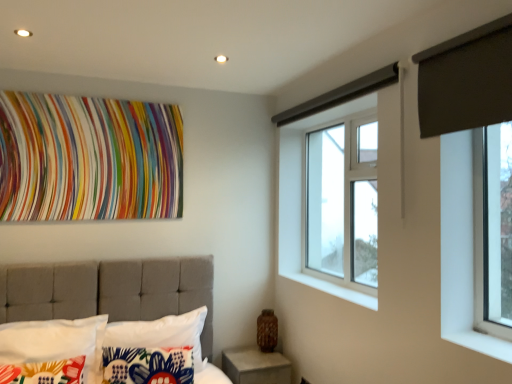
What do you see at coordinates (51, 351) in the screenshot? The width and height of the screenshot is (512, 384). I see `white fabric pillow at lower left, arranged as the 1th pillow when viewed from the left` at bounding box center [51, 351].

What is the approximate width of white fabric pillow at lower left, arranged as the 1th pillow when viewed from the left?

The width of white fabric pillow at lower left, arranged as the 1th pillow when viewed from the left, is 8.22 inches.

Measure the distance between dark gray fabric at upper right and camera.

The distance of dark gray fabric at upper right from camera is 5.12 feet.

The width and height of the screenshot is (512, 384). What do you see at coordinates (148, 365) in the screenshot?
I see `floral fabric pillow at lower left, the 2th pillow in the right-to-left sequence` at bounding box center [148, 365].

Locate an element on the screen. floral fabric pillow at lower left, the 2th pillow in the right-to-left sequence is located at coordinates (148, 365).

Locate an element on the screen. This screenshot has width=512, height=384. white fabric pillow at lower left, arranged as the 1th pillow when viewed from the left is located at coordinates (51, 351).

Is multicolored fabric at upper center in front of or behind concrete at lower right in the image?

multicolored fabric at upper center is in front of concrete at lower right.

Considering the relative positions of multicolored fabric at upper center and concrete at lower right in the image provided, is multicolored fabric at upper center to the right of concrete at lower right from the viewer's perspective?

No, multicolored fabric at upper center is not to the right of concrete at lower right.

Is multicolored fabric at upper center taller or shorter than concrete at lower right?

Considering their sizes, multicolored fabric at upper center has more height than concrete at lower right.

Is multicolored fabric at upper center bigger or smaller than concrete at lower right?

Considering their sizes, multicolored fabric at upper center takes up less space than concrete at lower right.

Are dark gray fabric at upper right and multicolored fabric at upper center located far from each other?

Yes, dark gray fabric at upper right is far from multicolored fabric at upper center.

Measure the distance between dark gray fabric at upper right and multicolored fabric at upper center.

dark gray fabric at upper right and multicolored fabric at upper center are 2.04 meters apart from each other.

Consider the image. Considering the relative sizes of dark gray fabric at upper right and multicolored fabric at upper center in the image provided, is dark gray fabric at upper right taller than multicolored fabric at upper center?

Incorrect, the height of dark gray fabric at upper right is not larger of that of multicolored fabric at upper center.

Would you say dark gray fabric at upper right is inside or outside multicolored fabric at upper center?

dark gray fabric at upper right exists outside the volume of multicolored fabric at upper center.

From the image's perspective, which one is positioned lower, multicolored fabric at upper center or white concrete at lower center?

white concrete at lower center.

Is multicolored fabric at upper center oriented towards white concrete at lower center?

No, multicolored fabric at upper center is not aimed at white concrete at lower center.

Would you consider multicolored fabric at upper center to be distant from white concrete at lower center?

Yes, multicolored fabric at upper center and white concrete at lower center are quite far apart.

Between multicolored fabric at upper center and white concrete at lower center, which one has smaller size?

With smaller size is white concrete at lower center.

Is white concrete at lower center inside the boundaries of white fabric pillow at lower left, the first pillow from the right, or outside?

white concrete at lower center cannot be found inside white fabric pillow at lower left, the first pillow from the right.

Is white fabric pillow at lower left, arranged as the 3th pillow when viewed from the left, at the back of white concrete at lower center?

No, white concrete at lower center is not facing the opposite direction of white fabric pillow at lower left, arranged as the 3th pillow when viewed from the left.

Does white concrete at lower center touch white fabric pillow at lower left, arranged as the 3th pillow when viewed from the left?

They are not placed beside each other.

From the image's perspective, is white concrete at lower center above or below white fabric pillow at lower left, the first pillow from the right?

white concrete at lower center is situated higher than white fabric pillow at lower left, the first pillow from the right, in the image.

Does multicolored fabric at upper center have a greater height compared to white fabric pillow at lower left, positioned as the third pillow in right-to-left order?

Yes, multicolored fabric at upper center is taller than white fabric pillow at lower left, positioned as the third pillow in right-to-left order.

Is multicolored fabric at upper center facing away from white fabric pillow at lower left, positioned as the third pillow in right-to-left order?

No, multicolored fabric at upper center's orientation is not away from white fabric pillow at lower left, positioned as the third pillow in right-to-left order.

Is point (116, 137) closer or farther from the camera than point (51, 341)?

Clearly, point (116, 137) is more distant from the camera than point (51, 341).

Would you say multicolored fabric at upper center is a long distance from white fabric pillow at lower left, arranged as the 1th pillow when viewed from the left?

No, multicolored fabric at upper center is not far from white fabric pillow at lower left, arranged as the 1th pillow when viewed from the left.

In the scene shown: Which is less distant, (180, 155) or (141, 325)?

Point (141, 325)

Can you confirm if multicolored fabric at upper center is bigger than white fabric pillow at lower left, the first pillow from the right?

No.

From the image's perspective, who appears lower, multicolored fabric at upper center or white fabric pillow at lower left, arranged as the 3th pillow when viewed from the left?

From the image's view, white fabric pillow at lower left, arranged as the 3th pillow when viewed from the left, is below.

Which is behind, multicolored fabric at upper center or white fabric pillow at lower left, arranged as the 3th pillow when viewed from the left?

multicolored fabric at upper center is further away from the camera.

Is white fabric pillow at lower left, arranged as the 1th pillow when viewed from the left, shorter than white fabric pillow at lower left, the first pillow from the right?

Correct, white fabric pillow at lower left, arranged as the 1th pillow when viewed from the left, is not as tall as white fabric pillow at lower left, the first pillow from the right.

Locate an element on the screen. pillow that is the 2nd object located behind the white fabric pillow at lower left, positioned as the third pillow in right-to-left order is located at coordinates (161, 333).

From the image's perspective, between white fabric pillow at lower left, arranged as the 1th pillow when viewed from the left, and white fabric pillow at lower left, the first pillow from the right, who is located below?

white fabric pillow at lower left, the first pillow from the right.

Is white fabric pillow at lower left, positioned as the third pillow in right-to-left order, thinner than white fabric pillow at lower left, arranged as the 3th pillow when viewed from the left?

Yes, white fabric pillow at lower left, positioned as the third pillow in right-to-left order, is thinner than white fabric pillow at lower left, arranged as the 3th pillow when viewed from the left.

At what (x,y) coordinates should I click in order to perform the action: click on tapestry above the concrete at lower right (from the image's perspective). Please return your answer as a coordinate pair (x, y). The width and height of the screenshot is (512, 384). Looking at the image, I should click on (88, 158).

I want to click on tapestry behind the dark gray fabric at upper right, so click(x=88, y=158).

In the scene shown: Considering their positions, is white fabric pillow at lower left, the first pillow from the right, positioned further to floral fabric pillow at lower left, the 2th pillow in the right-to-left sequence, than dark gray fabric at upper right?

Among the two, dark gray fabric at upper right is located further to floral fabric pillow at lower left, the 2th pillow in the right-to-left sequence.

From the image, which object appears to be farther from clear glass window at upper center, white fabric pillow at lower left, positioned as the third pillow in right-to-left order, or white concrete at lower center?

white fabric pillow at lower left, positioned as the third pillow in right-to-left order, is further to clear glass window at upper center.

Which object lies nearer to the anchor point white fabric pillow at lower left, arranged as the 3th pillow when viewed from the left, floral fabric pillow at lower left, which ranks as the 2th pillow in left-to-right order, or concrete at lower right?

Among the two, floral fabric pillow at lower left, which ranks as the 2th pillow in left-to-right order, is located nearer to white fabric pillow at lower left, arranged as the 3th pillow when viewed from the left.

From the image, which object appears to be farther from white fabric pillow at lower left, arranged as the 3th pillow when viewed from the left, clear glass window at upper center or dark gray fabric at upper right?

dark gray fabric at upper right is further to white fabric pillow at lower left, arranged as the 3th pillow when viewed from the left.

Considering their positions, is white fabric pillow at lower left, positioned as the third pillow in right-to-left order, positioned further to clear glass window at upper center than white fabric pillow at lower left, arranged as the 3th pillow when viewed from the left?

Based on the image, white fabric pillow at lower left, positioned as the third pillow in right-to-left order, appears to be further to clear glass window at upper center.

When comparing their distances from white concrete at lower center, does white fabric pillow at lower left, positioned as the third pillow in right-to-left order, or white fabric pillow at lower left, the first pillow from the right, seem further?

Among the two, white fabric pillow at lower left, positioned as the third pillow in right-to-left order, is located further to white concrete at lower center.

Considering their positions, is concrete at lower right positioned further to dark gray fabric at upper right than white concrete at lower center?

concrete at lower right is positioned further to the anchor dark gray fabric at upper right.

When comparing their distances from white fabric pillow at lower left, positioned as the third pillow in right-to-left order, does white fabric pillow at lower left, arranged as the 3th pillow when viewed from the left, or floral fabric pillow at lower left, the 2th pillow in the right-to-left sequence, seem further?

white fabric pillow at lower left, arranged as the 3th pillow when viewed from the left, lies further to white fabric pillow at lower left, positioned as the third pillow in right-to-left order, than the other object.

I want to click on window sill between multicolored fabric at upper center and dark gray fabric at upper right from left to right, so click(x=334, y=289).

You are a GUI agent. You are given a task and a screenshot of the screen. Output one action in this format:
    pyautogui.click(x=<x>, y=<y>)
    Task: Click on the window sill between white fabric pillow at lower left, positioned as the third pillow in right-to-left order, and clear glass window at upper center from left to right
    The width and height of the screenshot is (512, 384).
    Given the screenshot: What is the action you would take?
    pyautogui.click(x=334, y=289)

This screenshot has width=512, height=384. Identify the location of bay window between floral fabric pillow at lower left, the 2th pillow in the right-to-left sequence, and dark gray fabric at upper right, in the horizontal direction. (342, 202).

Locate an element on the screen. tapestry located between white fabric pillow at lower left, arranged as the 1th pillow when viewed from the left, and dark gray fabric at upper right in the left-right direction is located at coordinates (88, 158).